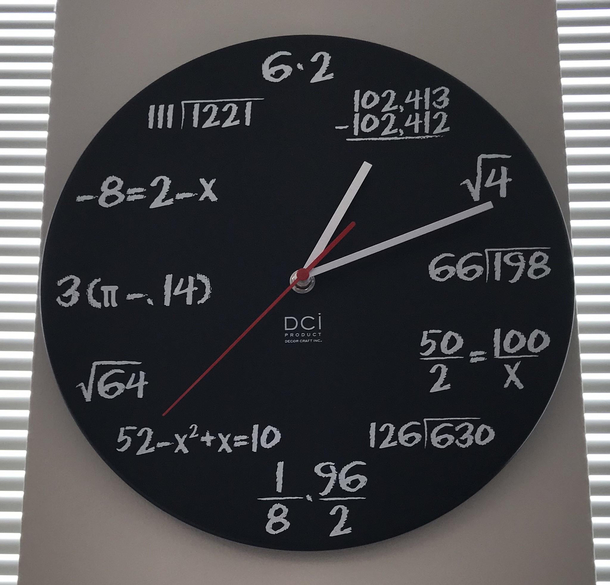
I want to click on minute hand on clock, so click(450, 222), click(58, 540).